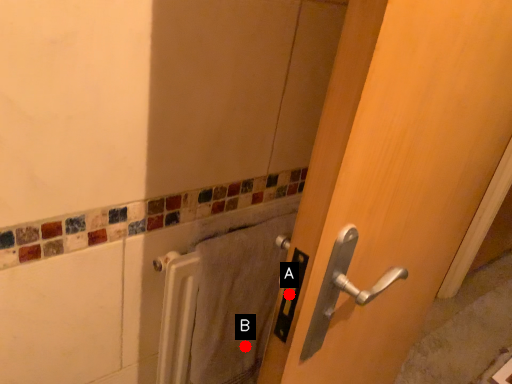
Question: Two points are circled on the image, labeled by A and B beside each circle. Which of the following is the closest to the observer?

Choices:
 (A) A is closer
 (B) B is closer

Answer: (A)